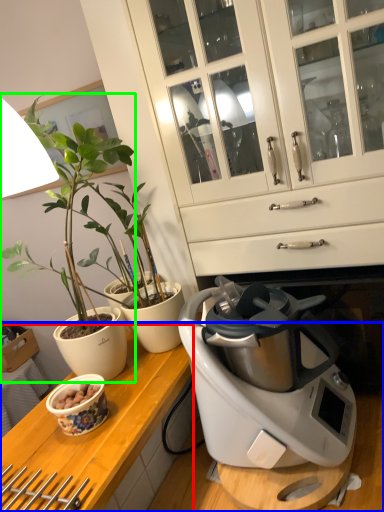
Question: Estimate the real-world distances between objects in this image. Which object is farther from counter top (highlighted by a red box), countertop (highlighted by a blue box) or houseplant (highlighted by a green box)?

Choices:
 (A) countertop
 (B) houseplant

Answer: (B)